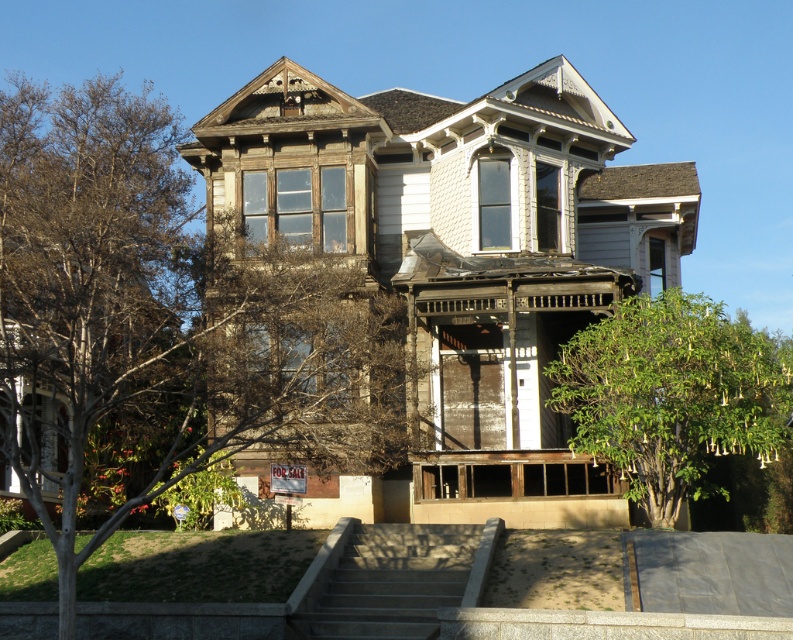
In the scene shown: Is bare wood tree at center positioned at the back of gray concrete stairs at center?

No, it is not.

Is bare wood tree at center to the left of gray concrete stairs at center from the viewer's perspective?

Indeed, bare wood tree at center is positioned on the left side of gray concrete stairs at center.

This screenshot has height=640, width=793. Describe the element at coordinates (163, 324) in the screenshot. I see `bare wood tree at center` at that location.

This screenshot has height=640, width=793. In order to click on bare wood tree at center in this screenshot , I will do `click(163, 324)`.

Who is positioned more to the left, bare wood tree at center or green leafy tree at lower right?

bare wood tree at center

Image resolution: width=793 pixels, height=640 pixels. What are the coordinates of `bare wood tree at center` in the screenshot? It's located at (163, 324).

Describe the element at coordinates (163, 324) in the screenshot. I see `bare wood tree at center` at that location.

The width and height of the screenshot is (793, 640). Find the location of `bare wood tree at center`. bare wood tree at center is located at coordinates (163, 324).

Is point (786, 342) positioned before point (431, 532)?

No, (786, 342) is further to viewer.

Who is more distant from viewer, (721, 390) or (401, 554)?

Point (721, 390)

Measure the distance between point [736,376] and camera.

Point [736,376] is 111.88 feet from camera.

You are a GUI agent. You are given a task and a screenshot of the screen. Output one action in this format:
    pyautogui.click(x=<x>, y=<y>)
    Task: Click on the green leafy tree at lower right
    Image resolution: width=793 pixels, height=640 pixels.
    Given the screenshot: What is the action you would take?
    coord(672,394)